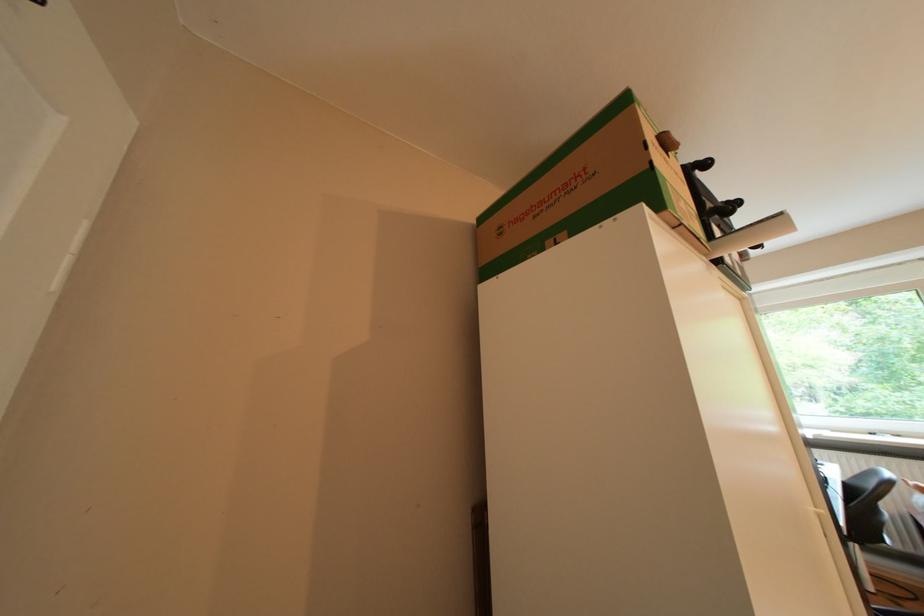
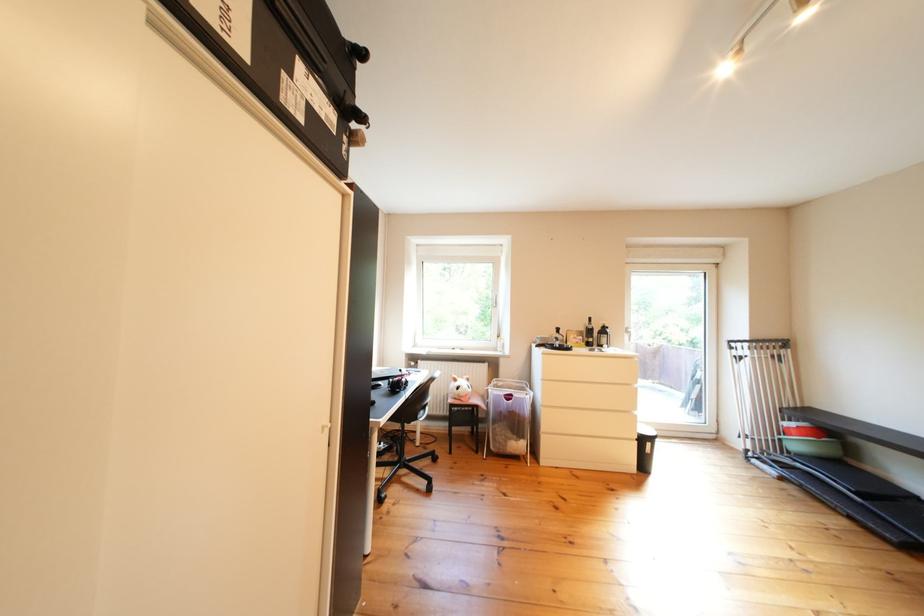
Question: The images are taken continuously from a first-person perspective. In which direction is your viewpoint rotating?

Choices:
 (A) Left
 (B) Right
 (C) Up
 (D) Down

Answer: (B)